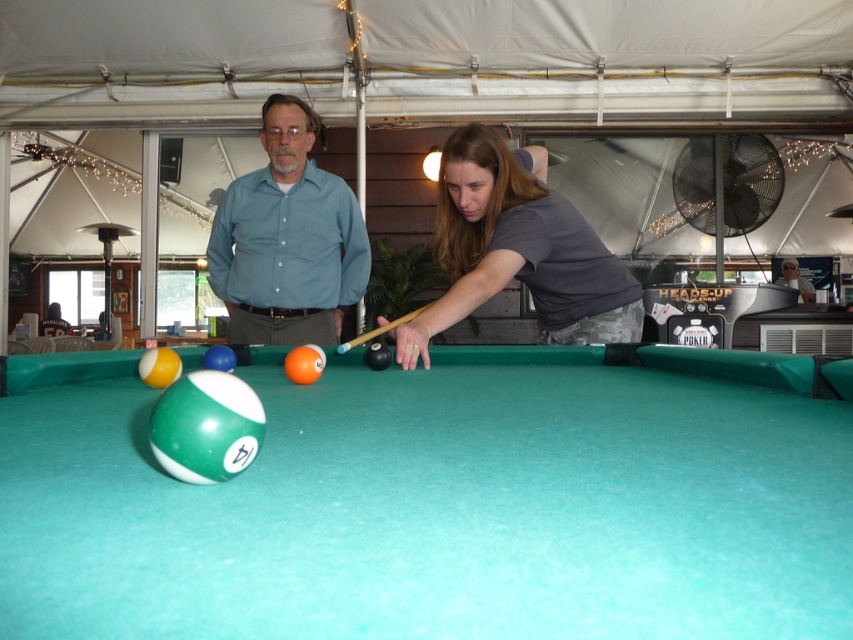
Question: Can you confirm if green felt billiard table at center is bigger than light blue shirt at center?

Choices:
 (A) no
 (B) yes

Answer: (B)

Question: Can you confirm if green felt billiard table at center is positioned above light blue shirt at center?

Choices:
 (A) yes
 (B) no

Answer: (B)

Question: Among these objects, which one is nearest to the camera?

Choices:
 (A) wooden cue at center
 (B) dark gray shirt at center

Answer: (B)

Question: Which point is closer to the camera?

Choices:
 (A) [344, 349]
 (B) [582, 305]

Answer: (A)

Question: Observing the image, what is the correct spatial positioning of dark gray shirt at center in reference to light blue shirt at center?

Choices:
 (A) right
 (B) left

Answer: (B)

Question: Which object is positioned farthest from the dark gray shirt at center?

Choices:
 (A) green felt billiard table at center
 (B) blue cotton shirt at center
 (C) light blue shirt at center
 (D) wooden cue at center

Answer: (C)